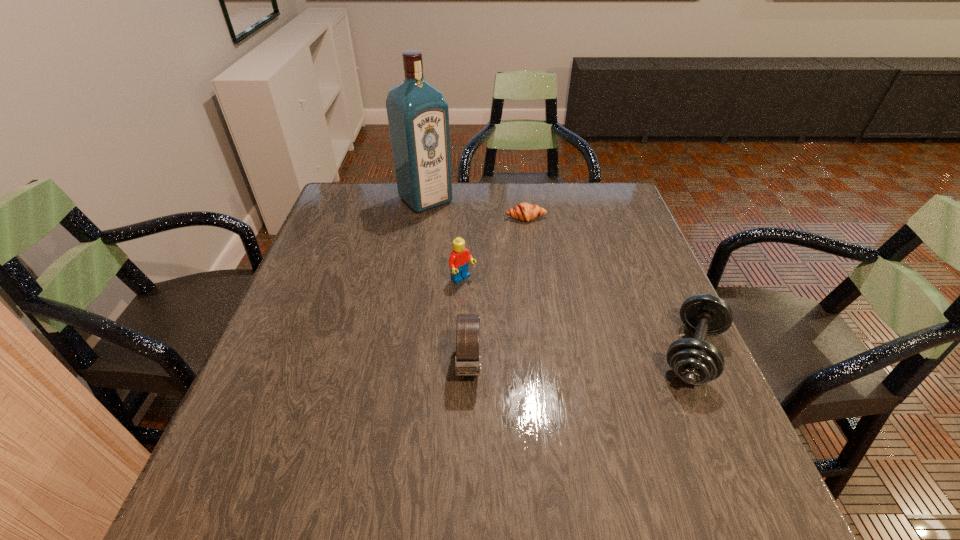
At what (x,y) coordinates should I click in order to perform the action: click on watch. Please return your answer as a coordinate pair (x, y). The image size is (960, 540). Looking at the image, I should click on (467, 360).

Where is `the rightmost object`? the rightmost object is located at coordinates (695, 361).

Where is `the second shortest object`? The image size is (960, 540). the second shortest object is located at coordinates (695, 361).

What are the coordinates of `the second object from right to left` in the screenshot? It's located at (524, 211).

You are a GUI agent. You are given a task and a screenshot of the screen. Output one action in this format:
    pyautogui.click(x=<x>, y=<y>)
    Task: Click on the pastry
    This screenshot has width=960, height=540.
    Given the screenshot: What is the action you would take?
    pyautogui.click(x=524, y=211)

Where is `the tallest object`? the tallest object is located at coordinates (418, 115).

The image size is (960, 540). In order to click on the leftmost object in this screenshot , I will do `click(418, 115)`.

At what (x,y) coordinates should I click in order to perform the action: click on Lego. Please return your answer as a coordinate pair (x, y). Looking at the image, I should click on (459, 262).

Identify the location of blank space located on the face of the watch. (468, 437).

Where is `free point located 0.350m on the back of the fourth tallest object`? This screenshot has width=960, height=540. free point located 0.350m on the back of the fourth tallest object is located at coordinates (636, 226).